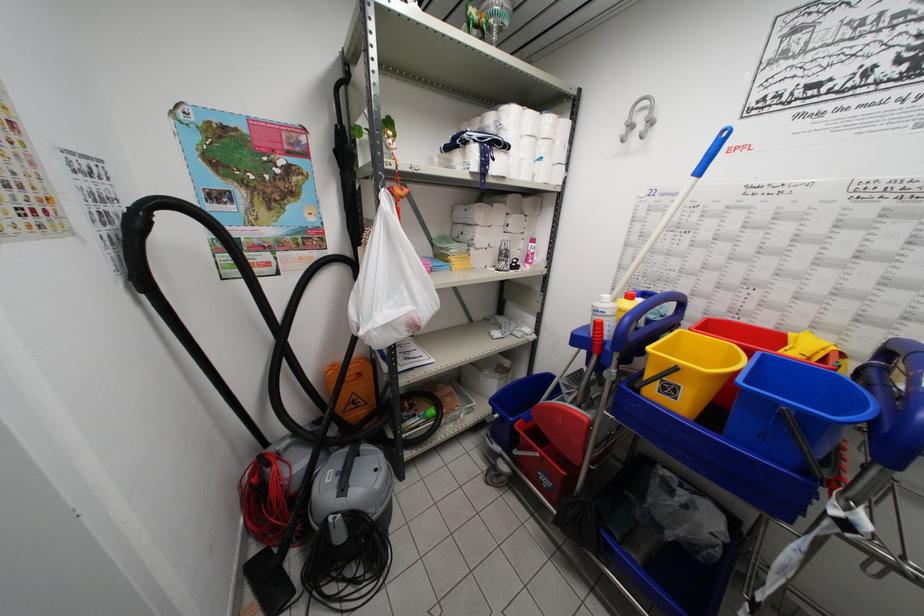
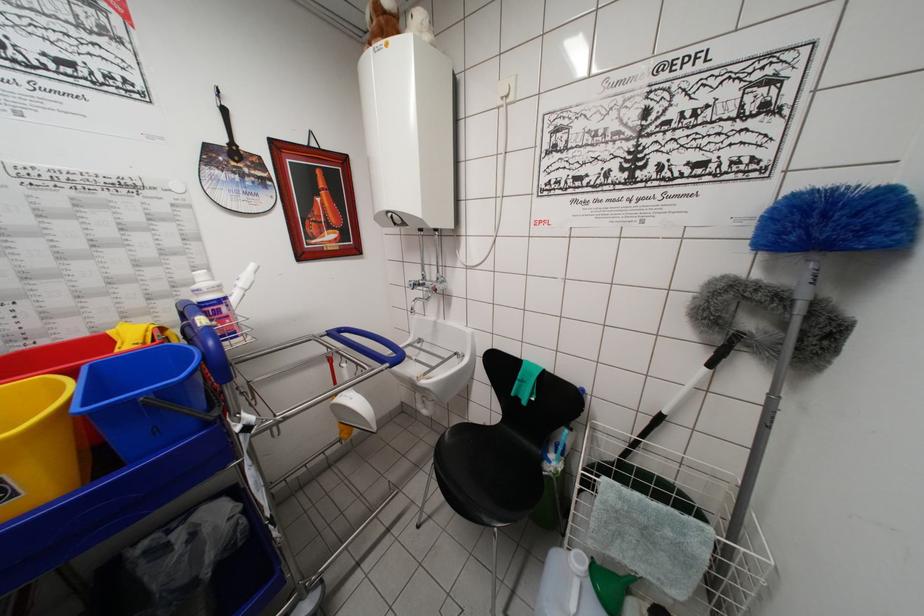
Question: I am providing you with two images of the same scene from different viewpoints. Please identify which objects are invisible in image2.

Choices:
 (A) white cleaner bottle
 (B) blue duster
 (C) blue rack handle
 (D) none of these

Answer: (D)